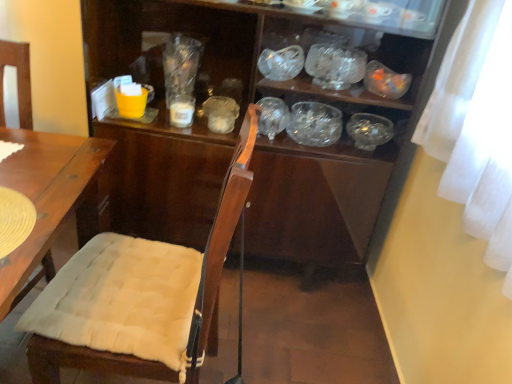
Question: Does white glossy cup at center, the 3th tableware when ordered from right to left, come in front of transparent glass bowl at center, positioned as the 2th glass bowl in top-to-bottom order?

Choices:
 (A) no
 (B) yes

Answer: (A)

Question: Does white glossy cup at center, the 2th tableware positioned from the left, have a lesser height compared to transparent glass bowl at center, which ranks as the first glass bowl in bottom-to-top order?

Choices:
 (A) no
 (B) yes

Answer: (B)

Question: From the image's perspective, is white glossy cup at center, the 2th tableware positioned from the left, beneath transparent glass bowl at center, which ranks as the first glass bowl in bottom-to-top order?

Choices:
 (A) no
 (B) yes

Answer: (A)

Question: Is white glossy cup at center, the 2th tableware positioned from the left, at the right side of transparent glass bowl at center, which ranks as the first glass bowl in bottom-to-top order?

Choices:
 (A) no
 (B) yes

Answer: (A)

Question: From a real-world perspective, does white glossy cup at center, the 3th tableware when ordered from right to left, stand above transparent glass bowl at center, which ranks as the first glass bowl in bottom-to-top order?

Choices:
 (A) no
 (B) yes

Answer: (A)

Question: From a real-world perspective, is white glossy cup at center, the 2th tableware positioned from the left, positioned under transparent glass bowl at center, which ranks as the first glass bowl in bottom-to-top order, based on gravity?

Choices:
 (A) yes
 (B) no

Answer: (A)

Question: Can we say transparent glass bowl at upper center, the 1th glass bowl in the top-to-bottom sequence, lies outside matte yellow cup at upper left, the fourth tableware from the right?

Choices:
 (A) no
 (B) yes

Answer: (B)

Question: Can you confirm if transparent glass bowl at upper center, the 1th glass bowl in the top-to-bottom sequence, is positioned to the right of matte yellow cup at upper left, the fourth tableware from the right?

Choices:
 (A) no
 (B) yes

Answer: (B)

Question: Is transparent glass bowl at upper center, the 1th glass bowl in the top-to-bottom sequence, positioned in front of matte yellow cup at upper left, which is the first tableware from left to right?

Choices:
 (A) no
 (B) yes

Answer: (B)

Question: Is matte yellow cup at upper left, which is the first tableware from left to right, at the back of transparent glass bowl at upper center, positioned as the 2th glass bowl in bottom-to-top order?

Choices:
 (A) no
 (B) yes

Answer: (A)

Question: From a real-world perspective, is transparent glass bowl at upper center, positioned as the 2th glass bowl in bottom-to-top order, positioned over matte yellow cup at upper left, which is the first tableware from left to right, based on gravity?

Choices:
 (A) yes
 (B) no

Answer: (A)

Question: Is transparent glass bowl at upper center, positioned as the 2th glass bowl in bottom-to-top order, aimed at matte yellow cup at upper left, the fourth tableware from the right?

Choices:
 (A) yes
 (B) no

Answer: (B)

Question: Is transparent glass bowl at center, which ranks as the first glass bowl in bottom-to-top order, not near transparent glass bowl at center, the 4th tableware from the left?

Choices:
 (A) yes
 (B) no

Answer: (B)